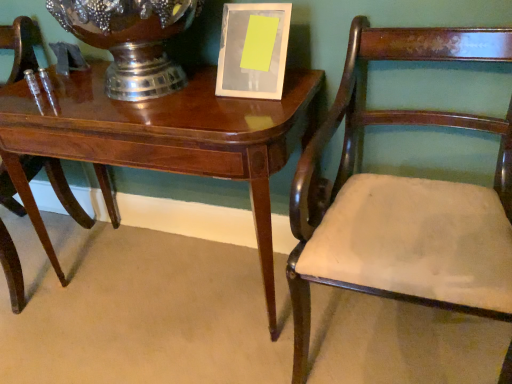
What are the coordinates of `free space in front of white glossy picture frame at upper center` in the screenshot? It's located at (245, 111).